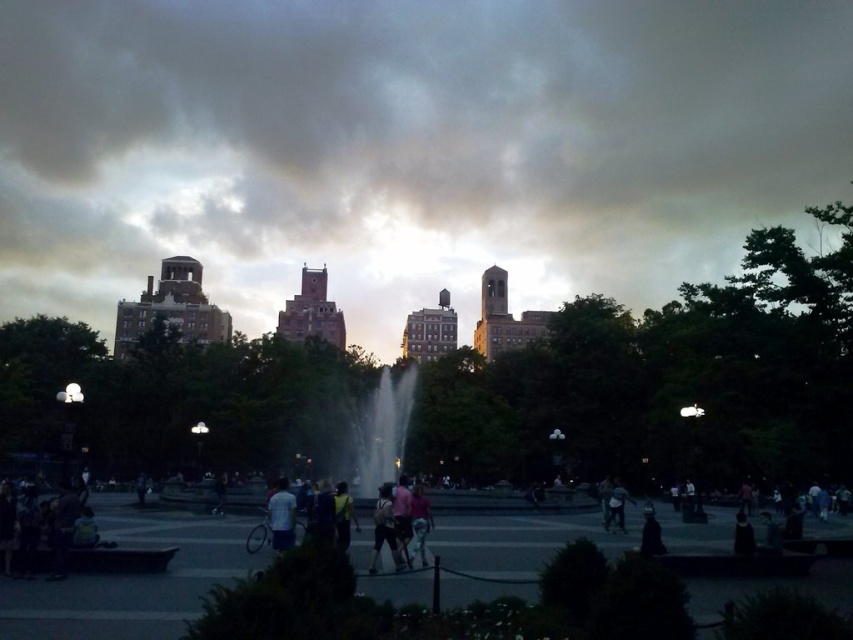
Question: Which point is closer to the camera?

Choices:
 (A) (653, 522)
 (B) (372, 563)
 (C) (349, 483)

Answer: (B)

Question: Among these points, which one is nearest to the camera?

Choices:
 (A) (390, 509)
 (B) (397, 372)
 (C) (648, 513)

Answer: (A)

Question: Is matte pink shirt at center above dark matte jacket at lower right?

Choices:
 (A) no
 (B) yes

Answer: (B)

Question: Can you confirm if light blue shirt at center is positioned below dark blue jeans at center?

Choices:
 (A) no
 (B) yes

Answer: (A)

Question: Which point is farther from the camera taking this photo?

Choices:
 (A) (737, 509)
 (B) (271, 548)

Answer: (A)

Question: Is clear glass fountain at center closer to camera compared to dark blue jeans at center?

Choices:
 (A) yes
 (B) no

Answer: (B)